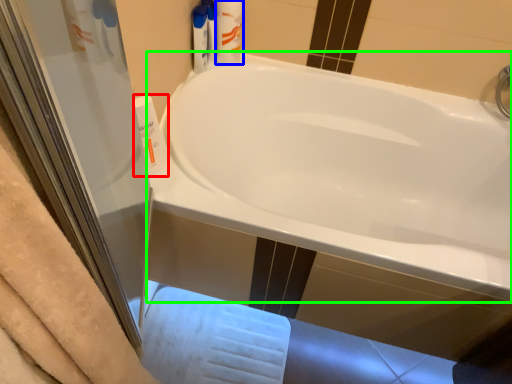
Question: Which object is positioned closest to cleaning product (highlighted by a red box)? Select from toiletry (highlighted by a blue box) and bathtub (highlighted by a green box).

Choices:
 (A) toiletry
 (B) bathtub

Answer: (A)